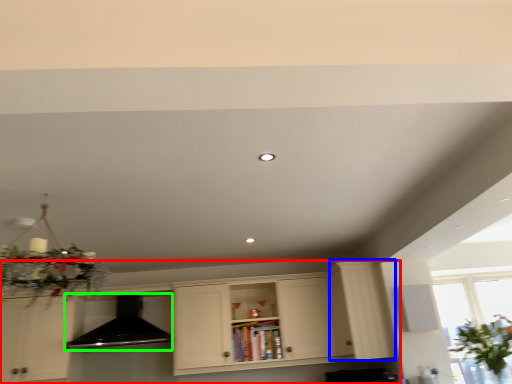
Question: Which is farther away from cabinetry (highlighted by a red box)? cabinetry (highlighted by a blue box) or exhaust hood (highlighted by a green box)?

Choices:
 (A) cabinetry
 (B) exhaust hood

Answer: (B)